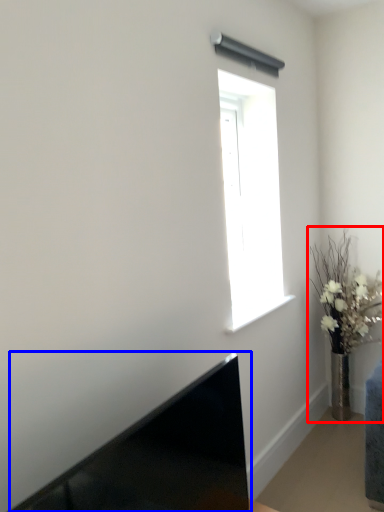
Question: Which object is closer to the camera taking this photo, houseplant (highlighted by a red box) or laptop (highlighted by a blue box)?

Choices:
 (A) houseplant
 (B) laptop

Answer: (B)